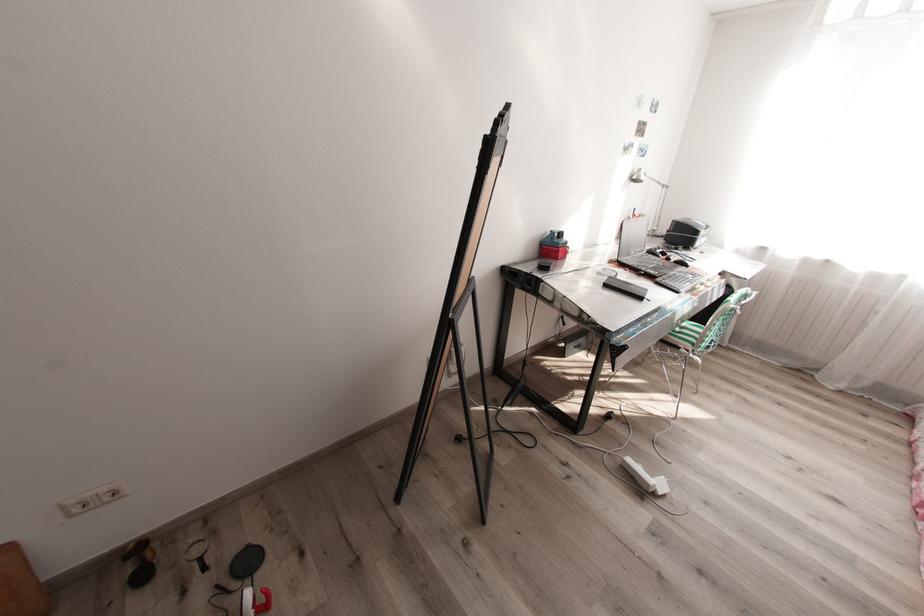
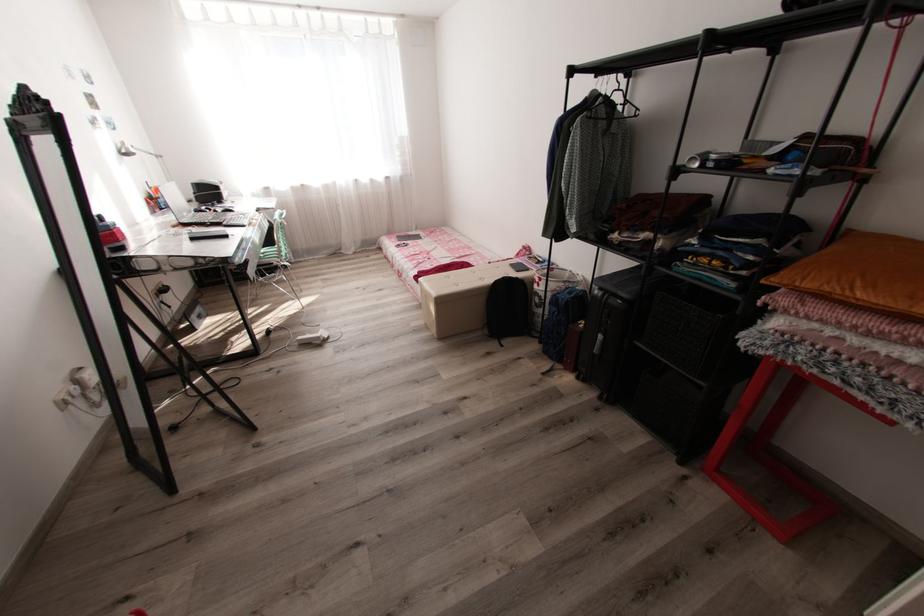
Based on the photo, based on the continuous images, in which direction is the camera rotating?

The camera rotated toward right-down.